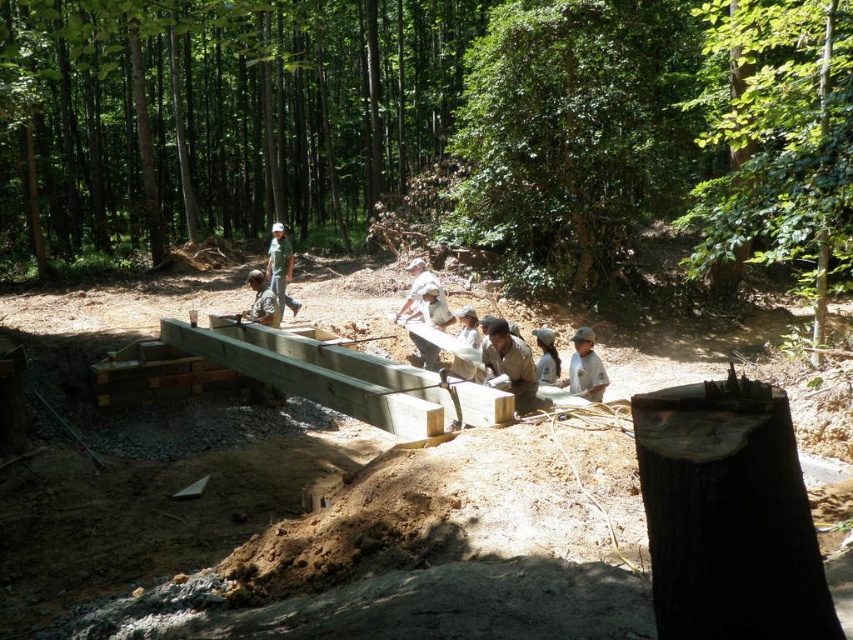
Based on the photo, can you confirm if green leafy forest at center is positioned to the right of dark brown wood at lower right?

Incorrect, green leafy forest at center is not on the right side of dark brown wood at lower right.

Is point (576, 90) positioned behind point (740, 413)?

Yes, point (576, 90) is behind point (740, 413).

Which is in front, point (44, 193) or point (763, 442)?

Positioned in front is point (763, 442).

The image size is (853, 640). I want to click on green leafy forest at center, so click(432, 129).

Does green leafy forest at center have a lesser height compared to green matte shirt at center?

No.

Locate an element on the screen. Image resolution: width=853 pixels, height=640 pixels. green leafy forest at center is located at coordinates (432, 129).

Measure the distance between green leafy forest at center and camera.

The distance of green leafy forest at center from camera is 18.31 feet.

Identify the location of green leafy forest at center. The image size is (853, 640). [432, 129].

Who is positioned more to the left, smooth wooden beams at center or white fabric shirt at center?

From the viewer's perspective, smooth wooden beams at center appears more on the left side.

Between smooth wooden beams at center and white fabric shirt at center, which one is positioned higher?

white fabric shirt at center

Is point (469, 552) farther from camera compared to point (552, 358)?

No, it is not.

At what (x,y) coordinates should I click in order to perform the action: click on smooth wooden beams at center. Please return your answer as a coordinate pair (x, y). This screenshot has height=640, width=853. Looking at the image, I should click on (317, 502).